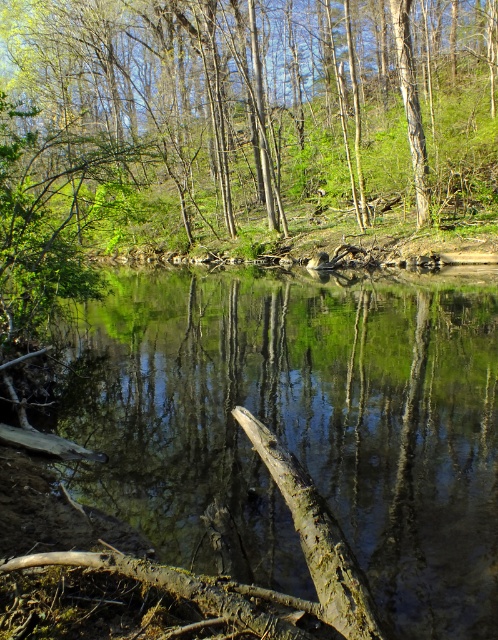
You are standing at the point where the viewer is located in the scene. There is a specific point marked at coordinates point (87, 428). If you want to place a small buoy there, will it be visible from your current position?

The point point (87, 428) is 27.90 feet away from the viewer, so yes, the buoy placed there would be visible from your current position as it is within a reasonable viewing distance.

You are standing at the edge of the brown muddy river at center and want to reach the smooth bark tree at center. Given that the distance between them is 67.61 feet, can you estimate how long it would take you to walk there at a normal pace?

The distance between the brown muddy river at center and the smooth bark tree at center is 67.61 feet. At a normal walking pace of about 3 feet per second, it would take approximately 22.5 seconds to reach the smooth bark tree at center.

You are standing on the bank of the brown muddy river at center and want to see the top of the smooth bark tree at center. Can you see it from your current position?

The smooth bark tree at center is taller than the brown muddy river at center, so yes, you can see the top of the smooth bark tree at center from your current position on the bank of the brown muddy river at center.